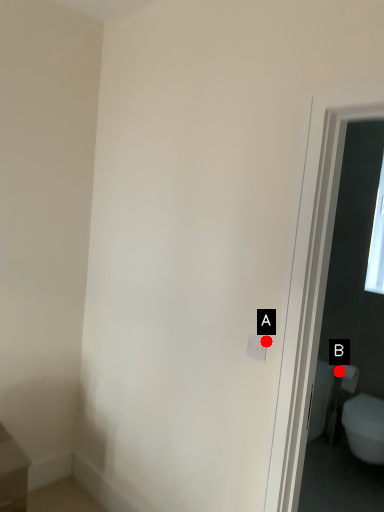
Question: Two points are circled on the image, labeled by A and B beside each circle. Which point is further to the camera?

Choices:
 (A) A is further
 (B) B is further

Answer: (B)